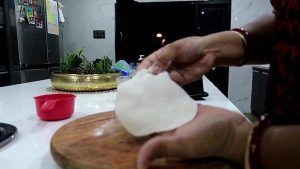
Locate an element on the screen. stainless steel refridgerator is located at coordinates (38, 46).